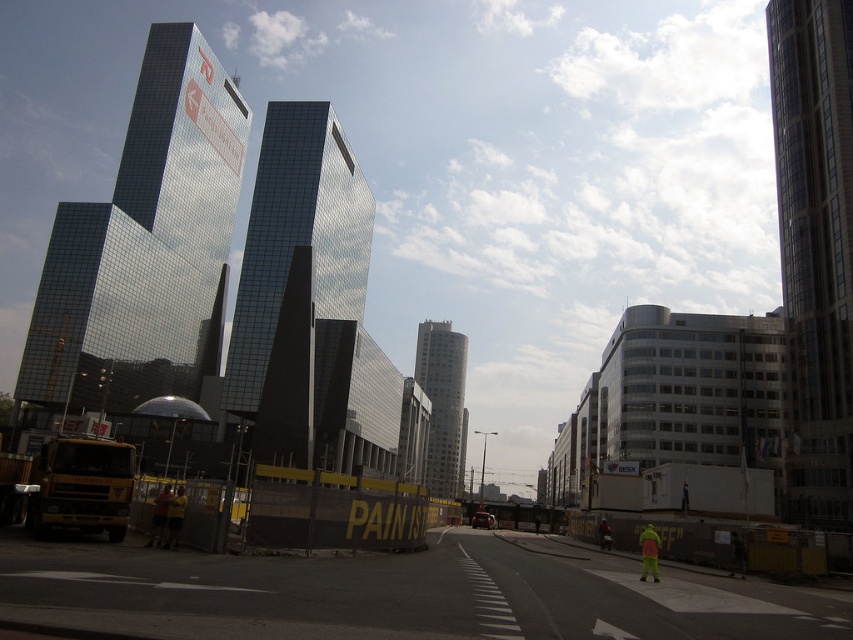
You are a delivery driver approaching the shiny glass skyscraper at center and the neon yellow reflective jacket at lower right. Which object is located to the left of the other?

The shiny glass skyscraper at center is positioned on the left side of neon yellow reflective jacket at lower right, so the skyscraper is to the left of the jacket.

You are a city planner reviewing this urban layout. There is a point marked at coordinates (297,237) in the image. Which object from the scene does this point correspond to?

The point at coordinates (297,237) marks the shiny glass skyscraper at center.

You are a pedestrian standing on the sidewalk near the reflective glass skyscraper at center and the neon yellow reflective jacket at lower right. Which object is closer to you?

The reflective glass skyscraper at center is closer to you since it is positioned further to the viewer than the neon yellow reflective jacket at lower right, meaning it appears nearer in your line of sight.